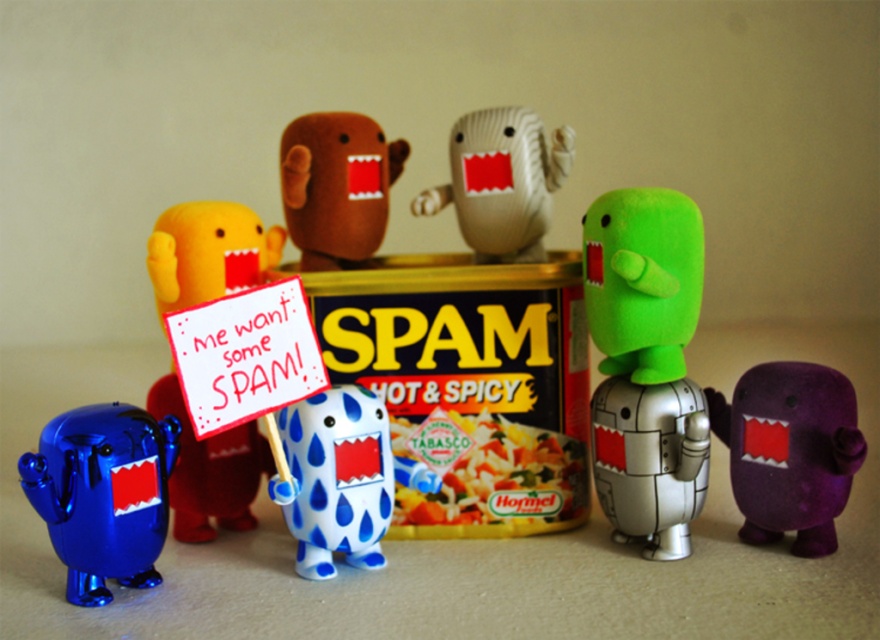
Question: Is yellowish matte tabasco sauce at center positioned at the back of matte brown plush toy at center?

Choices:
 (A) no
 (B) yes

Answer: (A)

Question: Which object is the closest to the green fabric toy at center-right?

Choices:
 (A) metallic blue robot at lower left
 (B) blue rubber toy at center
 (C) matte beige plush toy at center

Answer: (C)

Question: Can you confirm if metallic blue robot at lower left is positioned to the left of matte brown plush toy at center?

Choices:
 (A) yes
 (B) no

Answer: (A)

Question: Can you confirm if yellowish matte tabasco sauce at center is smaller than matte brown plush toy at center?

Choices:
 (A) yes
 (B) no

Answer: (A)

Question: Which point is farther to the camera?

Choices:
 (A) purple felt toy at right
 (B) matte brown plush toy at center
 (C) green fabric toy at center-right

Answer: (B)

Question: Estimate the real-world distances between objects in this image. Which object is farther from the green fabric toy at center-right?

Choices:
 (A) yellow plush toy at center
 (B) matte brown plush toy at center
 (C) metallic blue robot at lower left

Answer: (C)